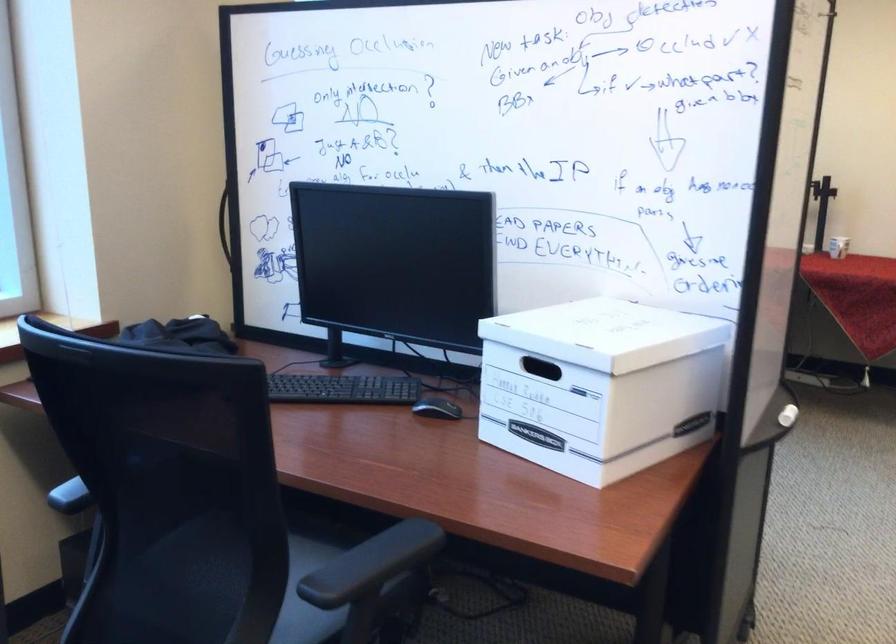
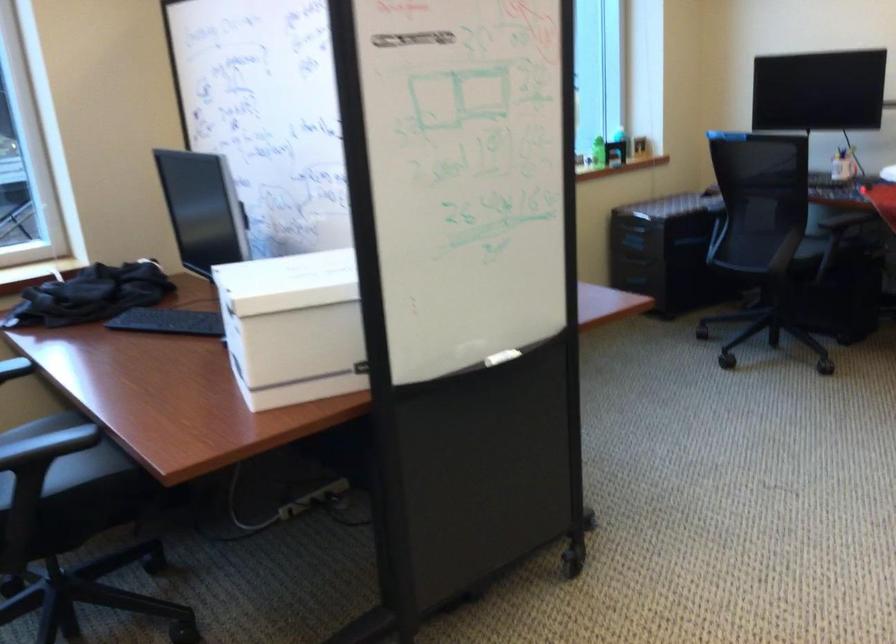
Where in the second image is the point corresponding to [640,391] from the first image?

(293, 327)